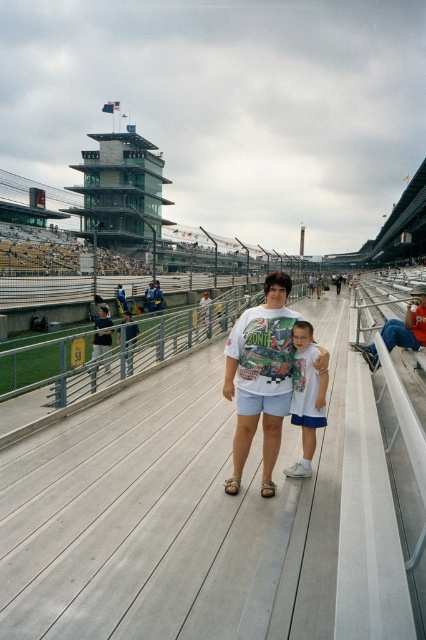
Is wooden planks at center wider than dark blue shirt at center?

Correct, the width of wooden planks at center exceeds that of dark blue shirt at center.

Who is more forward, (224, 561) or (94, 326)?

Positioned in front is point (224, 561).

Between point (215, 534) and point (97, 353), which one is positioned behind?

The point (97, 353) is more distant.

This screenshot has width=426, height=640. I want to click on wooden planks at center, so click(x=203, y=516).

Is white cotton t-shirt at center below denim shorts at lower right?

Yes.

Between white cotton t-shirt at center and denim shorts at lower right, which one has less height?

denim shorts at lower right

Between point (271, 348) and point (374, 362), which one is positioned behind?

Point (374, 362)

This screenshot has width=426, height=640. Find the location of `white cotton t-shirt at center`. white cotton t-shirt at center is located at coordinates (261, 378).

Can you confirm if dark blue shirt at center is taller than blue denim jeans at center?

Incorrect, dark blue shirt at center's height is not larger of blue denim jeans at center's.

Which is in front, point (100, 324) or point (149, 285)?

Positioned in front is point (100, 324).

I want to click on dark blue shirt at center, so (x=103, y=337).